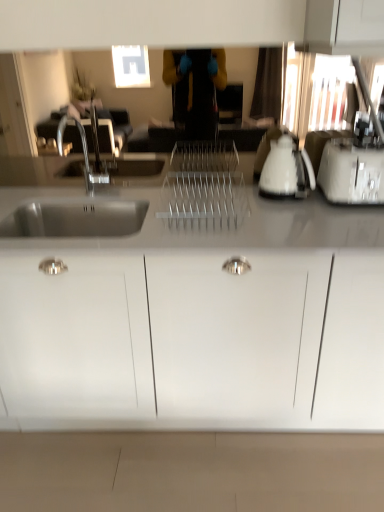
Question: Is the depth of white matte cabinet at center less than that of white plastic toaster at right?

Choices:
 (A) no
 (B) yes

Answer: (B)

Question: Would you say white matte cabinet at center contains white plastic toaster at right?

Choices:
 (A) yes
 (B) no

Answer: (B)

Question: Are white matte cabinet at center and white plastic toaster at right making contact?

Choices:
 (A) no
 (B) yes

Answer: (A)

Question: From a real-world perspective, is white matte cabinet at center positioned under white plastic toaster at right based on gravity?

Choices:
 (A) no
 (B) yes

Answer: (B)

Question: Can you confirm if white matte cabinet at center is wider than white plastic toaster at right?

Choices:
 (A) yes
 (B) no

Answer: (A)

Question: Can you confirm if white matte cabinet at center is smaller than white plastic toaster at right?

Choices:
 (A) no
 (B) yes

Answer: (A)

Question: Is white plastic toaster at right oriented away from white matte cabinet at center?

Choices:
 (A) no
 (B) yes

Answer: (A)

Question: Does white plastic toaster at right have a smaller size compared to white matte cabinet at center?

Choices:
 (A) yes
 (B) no

Answer: (A)

Question: Is white plastic toaster at right positioned before white matte cabinet at center?

Choices:
 (A) yes
 (B) no

Answer: (B)

Question: Does white plastic toaster at right have a greater height compared to white matte cabinet at center?

Choices:
 (A) no
 (B) yes

Answer: (A)

Question: From a real-world perspective, does white plastic toaster at right stand above white matte cabinet at center?

Choices:
 (A) no
 (B) yes

Answer: (B)

Question: Is white plastic toaster at right to the left of white matte cabinet at center from the viewer's perspective?

Choices:
 (A) no
 (B) yes

Answer: (A)

Question: Is white glossy electric kettle at right bigger than white matte cabinet at center?

Choices:
 (A) yes
 (B) no

Answer: (B)